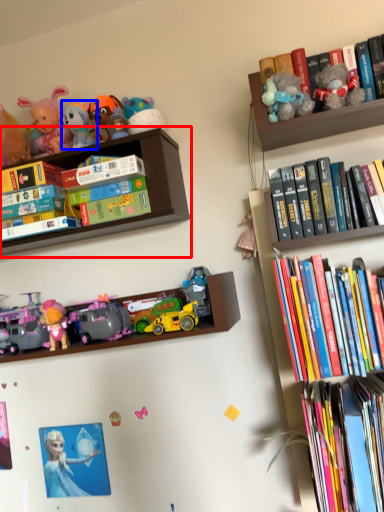
Question: Among these objects, which one is nearest to the camera, shelf (highlighted by a red box) or toy (highlighted by a blue box)?

Choices:
 (A) shelf
 (B) toy

Answer: (A)